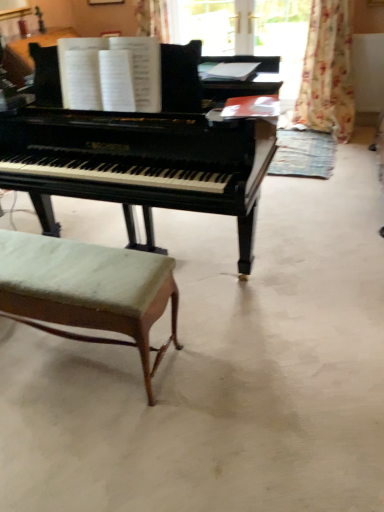
Question: Is green fabric stool at lower left in front of floral fabric curtain at upper right?

Choices:
 (A) no
 (B) yes

Answer: (B)

Question: Can you confirm if green fabric stool at lower left is smaller than floral fabric curtain at upper right?

Choices:
 (A) no
 (B) yes

Answer: (B)

Question: From a real-world perspective, is green fabric stool at lower left physically above floral fabric curtain at upper right?

Choices:
 (A) yes
 (B) no

Answer: (B)

Question: Would you consider green fabric stool at lower left to be distant from floral fabric curtain at upper right?

Choices:
 (A) yes
 (B) no

Answer: (A)

Question: From a real-world perspective, is green fabric stool at lower left positioned under floral fabric curtain at upper right based on gravity?

Choices:
 (A) no
 (B) yes

Answer: (B)

Question: Does point (271, 182) appear closer or farther from the camera than point (36, 210)?

Choices:
 (A) closer
 (B) farther

Answer: (B)

Question: Looking at their shapes, would you say black piano at center is wider or thinner than black polished piano at center?

Choices:
 (A) wide
 (B) thin

Answer: (A)

Question: Based on their sizes in the image, would you say black piano at center is bigger or smaller than black polished piano at center?

Choices:
 (A) big
 (B) small

Answer: (B)

Question: Considering their positions, is black piano at center located in front of or behind black polished piano at center?

Choices:
 (A) behind
 (B) front

Answer: (B)

Question: From a real-world perspective, is green fabric stool at lower left positioned above or below black piano at center?

Choices:
 (A) below
 (B) above

Answer: (B)

Question: From the image's perspective, is green fabric stool at lower left above or below black piano at center?

Choices:
 (A) below
 (B) above

Answer: (A)

Question: From their relative heights in the image, would you say green fabric stool at lower left is taller or shorter than black piano at center?

Choices:
 (A) short
 (B) tall

Answer: (B)

Question: Is green fabric stool at lower left situated inside black piano at center or outside?

Choices:
 (A) outside
 (B) inside

Answer: (A)

Question: Considering the positions of black polished piano at center and floral fabric curtain at upper right in the image, is black polished piano at center bigger or smaller than floral fabric curtain at upper right?

Choices:
 (A) big
 (B) small

Answer: (A)

Question: Considering the positions of black polished piano at center and floral fabric curtain at upper right in the image, is black polished piano at center wider or thinner than floral fabric curtain at upper right?

Choices:
 (A) wide
 (B) thin

Answer: (A)